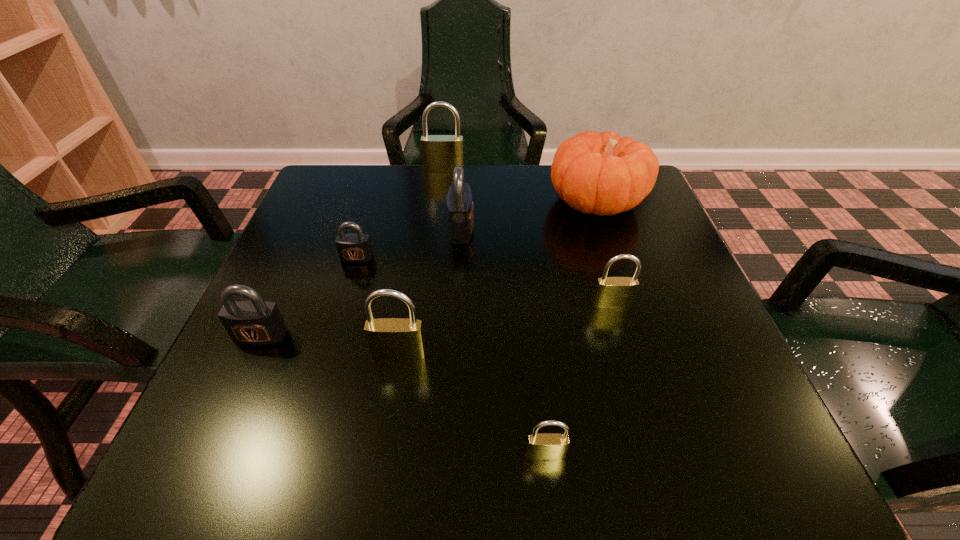
Image resolution: width=960 pixels, height=540 pixels. In order to click on free space that satisfies the following two spatial constraints: 1. on the front of the biggest gray padlock near the keyhole; 2. on the front-facing side of the seventh farthest object in this screenshot , I will do `click(455, 354)`.